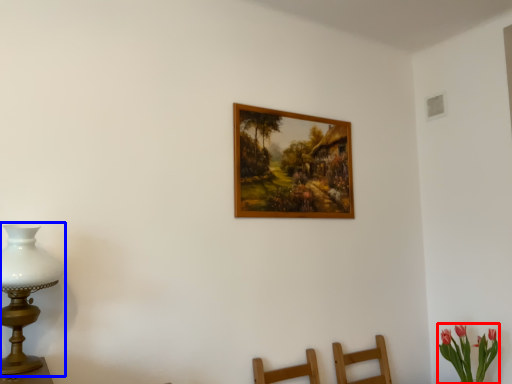
Question: Which point is closer to the camera, floral arrangement (highlighted by a red box) or table lamp (highlighted by a blue box)?

Choices:
 (A) floral arrangement
 (B) table lamp

Answer: (B)